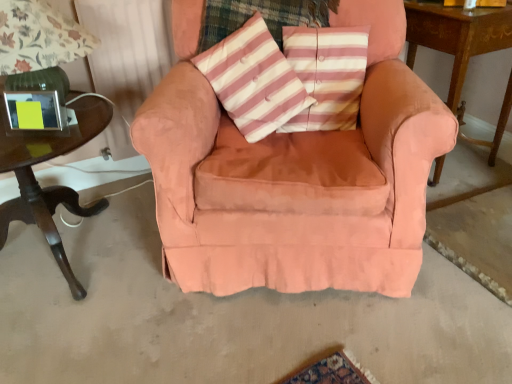
Identify the location of space that is in front of dark wood table at left, positioned as the second table in right-to-left order. The image size is (512, 384). (92, 337).